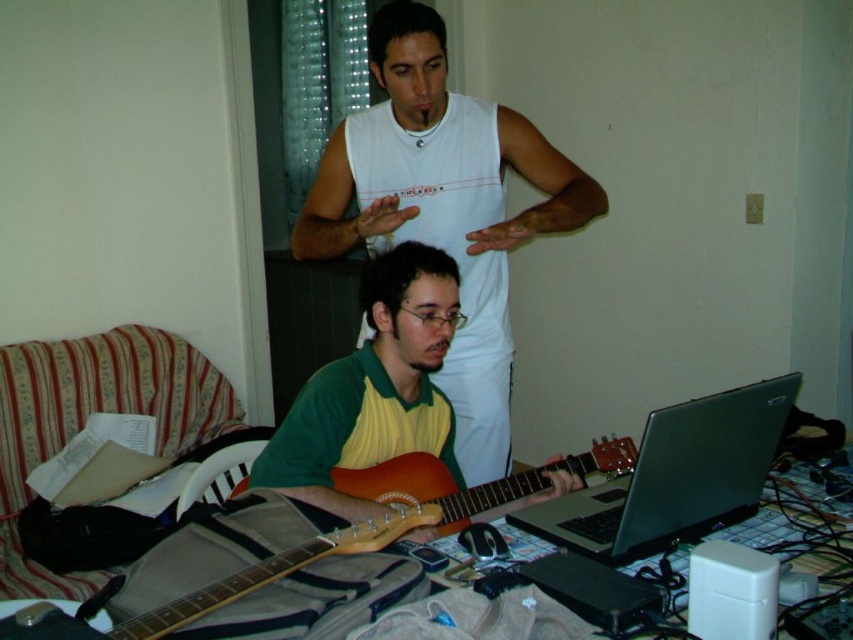
Question: Among these objects, which one is nearest to the camera?

Choices:
 (A) green/yellow jersey at center
 (B) wooden acoustic guitar at center

Answer: (A)

Question: Is green/yellow jersey at center positioned behind silver/black laptop at center?

Choices:
 (A) yes
 (B) no

Answer: (A)

Question: Which point is farther from the camera taking this photo?

Choices:
 (A) (683, 454)
 (B) (437, 236)

Answer: (B)

Question: Considering the real-world distances, which object is farthest from the white sleeveless shirt at upper center?

Choices:
 (A) green/yellow jersey at center
 (B) wooden acoustic guitar at center
 (C) silver/black laptop at center

Answer: (C)

Question: Is white sleeveless shirt at upper center to the left of green/yellow jersey at center from the viewer's perspective?

Choices:
 (A) no
 (B) yes

Answer: (A)

Question: From the image, what is the correct spatial relationship of white sleeveless shirt at upper center in relation to green/yellow jersey at center?

Choices:
 (A) right
 (B) left

Answer: (A)